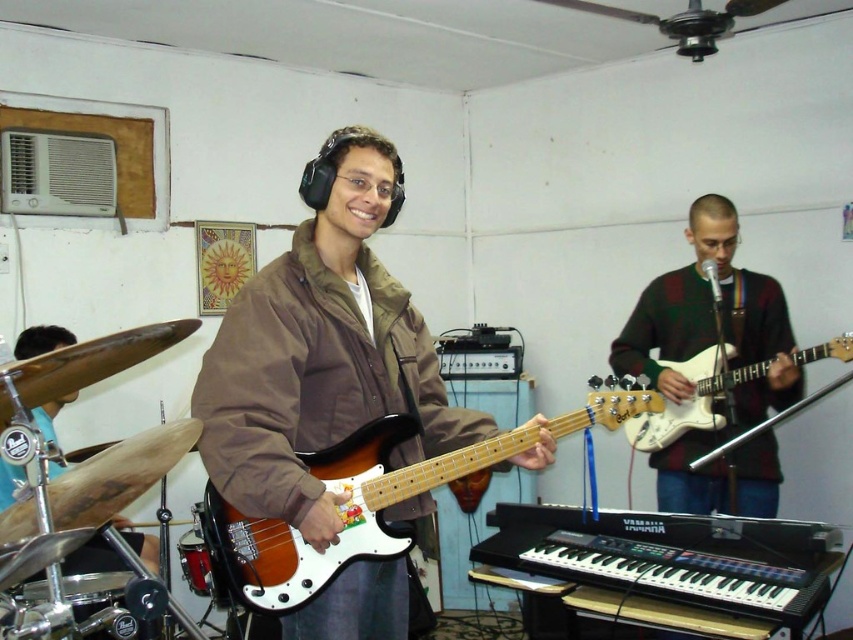
Describe the element at coordinates (322, 349) in the screenshot. I see `brown fabric jacket at center` at that location.

Measure the distance between point (405, 460) and camera.

A distance of 1.86 meters exists between point (405, 460) and camera.

Identify the location of brown fabric jacket at center. The width and height of the screenshot is (853, 640). (322, 349).

Is white glossy electric guitar at right taller than red drum at lower left?

Yes, white glossy electric guitar at right is taller than red drum at lower left.

Is white glossy electric guitar at right closer to the viewer compared to red drum at lower left?

Yes, white glossy electric guitar at right is in front of red drum at lower left.

Is point (708, 349) less distant than point (202, 561)?

Yes, it is.

Where is `white glossy electric guitar at right`? white glossy electric guitar at right is located at coordinates (693, 397).

Does satin wood bass guitar at center have a larger size compared to red drum at lower left?

Yes, satin wood bass guitar at center is bigger than red drum at lower left.

Consider the image. Does satin wood bass guitar at center have a lesser width compared to red drum at lower left?

No.

The image size is (853, 640). Describe the element at coordinates (343, 513) in the screenshot. I see `satin wood bass guitar at center` at that location.

I want to click on satin wood bass guitar at center, so click(343, 513).